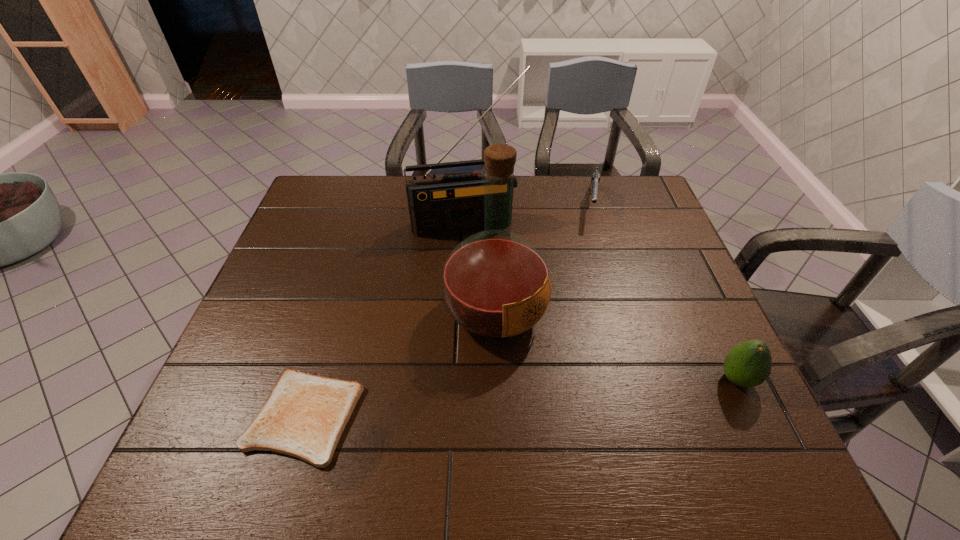
Choose which object is the second nearest neighbor to the radio receiver. Please provide its 2D coordinates. Your answer should be formatted as a tuple, i.e. [(x, y)], where the tuple contains the x and y coordinates of a point satisfying the conditions above.

[(595, 179)]

Where is `vacant region that satisfies the following two spatial constraints: 1. on the front side of the gun; 2. on the left side of the rightmost object`? The image size is (960, 540). vacant region that satisfies the following two spatial constraints: 1. on the front side of the gun; 2. on the left side of the rightmost object is located at coordinates (644, 380).

Locate an element on the screen. Image resolution: width=960 pixels, height=540 pixels. vacant area that satisfies the following two spatial constraints: 1. on the front side of the third farthest object; 2. on the right side of the radio receiver is located at coordinates (463, 312).